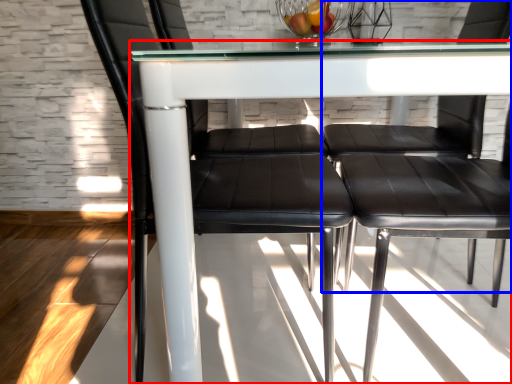
Question: Which of the following is the farthest to the observer, table (highlighted by a red box) or chair (highlighted by a blue box)?

Choices:
 (A) table
 (B) chair

Answer: (B)